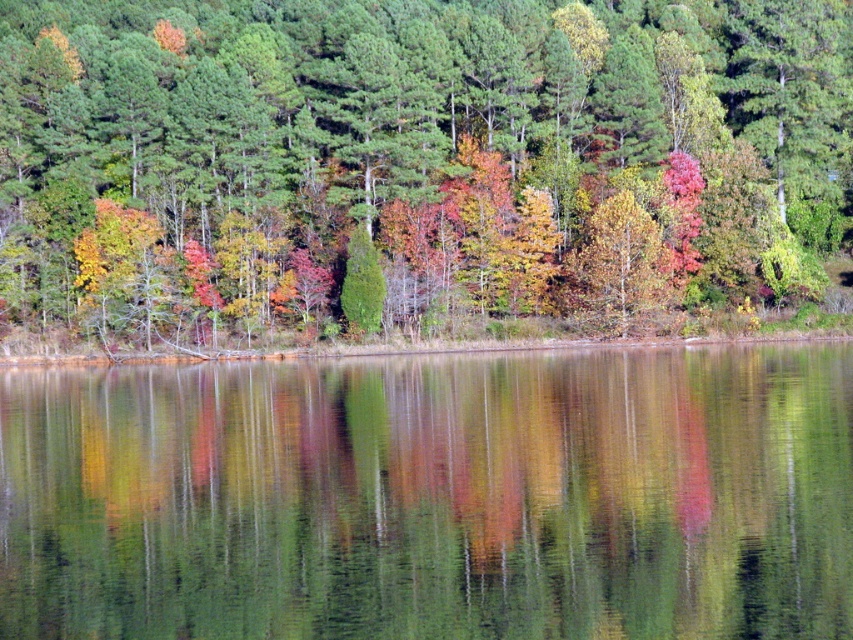
Is transparent water at center to the left of yellow-green textured tree at center from the viewer's perspective?

Correct, you'll find transparent water at center to the left of yellow-green textured tree at center.

Can you confirm if transparent water at center is positioned to the right of yellow-green textured tree at center?

Incorrect, transparent water at center is not on the right side of yellow-green textured tree at center.

Does point (851, 420) come closer to viewer compared to point (592, 275)?

Yes.

Find the location of a particular element. The height and width of the screenshot is (640, 853). transparent water at center is located at coordinates (433, 497).

Looking at this image, which is more to the right, multicolored foliage at center or transparent water at center?

transparent water at center is more to the right.

Is point (740, 148) in front of point (440, 580)?

No, it is not.

This screenshot has height=640, width=853. Identify the location of multicolored foliage at center. (415, 157).

Can you confirm if multicolored foliage at center is wider than yellow-green textured tree at center?

Indeed, multicolored foliage at center has a greater width compared to yellow-green textured tree at center.

Is point (503, 109) closer to viewer compared to point (619, 310)?

That is False.

What do you see at coordinates (415, 157) in the screenshot? I see `multicolored foliage at center` at bounding box center [415, 157].

Image resolution: width=853 pixels, height=640 pixels. I want to click on multicolored foliage at center, so click(415, 157).